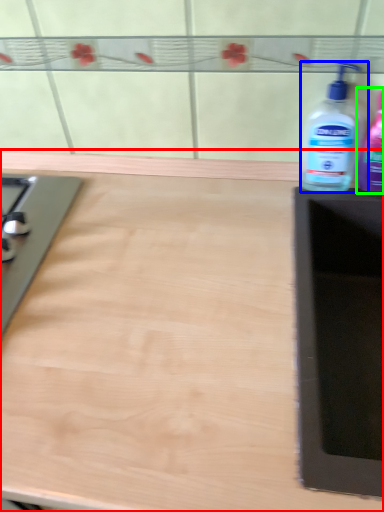
Question: Considering the real-world distances, which object is farthest from countertop (highlighted by a red box)? bottle (highlighted by a blue box) or bottle (highlighted by a green box)?

Choices:
 (A) bottle
 (B) bottle

Answer: (B)